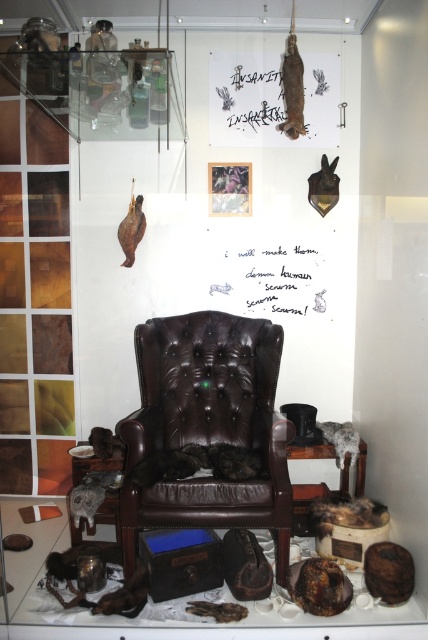
Question: Does brown leather armchair at center have a smaller size compared to white paper at center?

Choices:
 (A) no
 (B) yes

Answer: (A)

Question: Which of the following is the closest to the observer?

Choices:
 (A) white paper at center
 (B) brown leather armchair at center

Answer: (B)

Question: Which object appears closest to the camera in this image?

Choices:
 (A) brown leather armchair at center
 (B) white paper at center

Answer: (A)

Question: Can you confirm if brown leather armchair at center is positioned below white paper at center?

Choices:
 (A) no
 (B) yes

Answer: (B)

Question: Which point appears closest to the camera in this image?

Choices:
 (A) (276, 301)
 (B) (204, 432)

Answer: (B)

Question: Is brown leather armchair at center bigger than white paper at center?

Choices:
 (A) no
 (B) yes

Answer: (B)